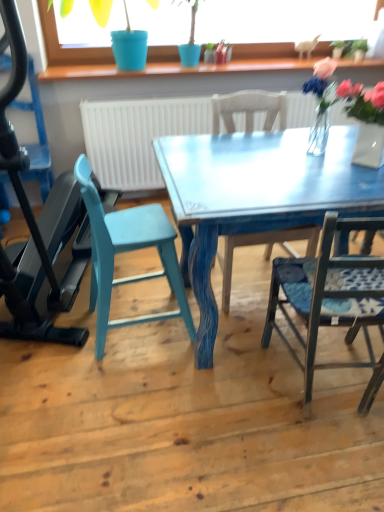
Question: Looking at their shapes, would you say translucent glass vase at upper right, the 1th floral arrangement in the left-to-right sequence, is wider or thinner than clear glass vase at upper right, the second floral arrangement when ordered from left to right?

Choices:
 (A) thin
 (B) wide

Answer: (A)

Question: From a real-world perspective, is translucent glass vase at upper right, the second floral arrangement when ordered from right to left, above or below clear glass vase at upper right, the second floral arrangement when ordered from left to right?

Choices:
 (A) below
 (B) above

Answer: (B)

Question: Which object is the farthest from the metallic blue treadmill at left?

Choices:
 (A) translucent glass vase at upper right, the 1th floral arrangement in the left-to-right sequence
 (B) teal painted wood chair at left, which is the fourth chair in right-to-left order
 (C) blue fabric chair at center, the 2th chair viewed from the right
 (D) blue plastic pot at upper center
 (E) green matte plant at upper right

Answer: (E)

Question: Estimate the real-world distances between objects in this image. Which object is closer to the teal painted wood chair at lower left, positioned as the 3th chair in right-to-left order?

Choices:
 (A) green matte plant at upper right
 (B) clear glass vase at upper right, the second floral arrangement when ordered from left to right
 (C) blue fabric chair at center, the 2th chair viewed from the right
 (D) metallic blue treadmill at left
 (E) metallic blue chair at right, which is the 1th chair in right-to-left order

Answer: (D)